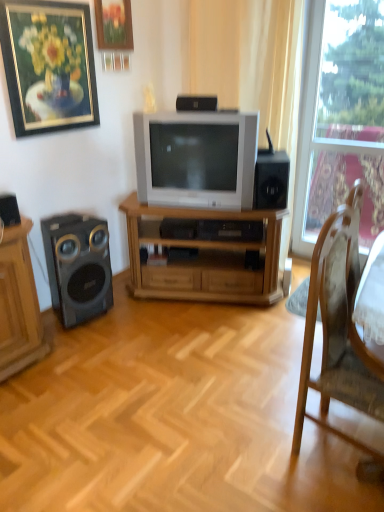
I want to click on free space in front of matte black speaker at left, so click(x=83, y=343).